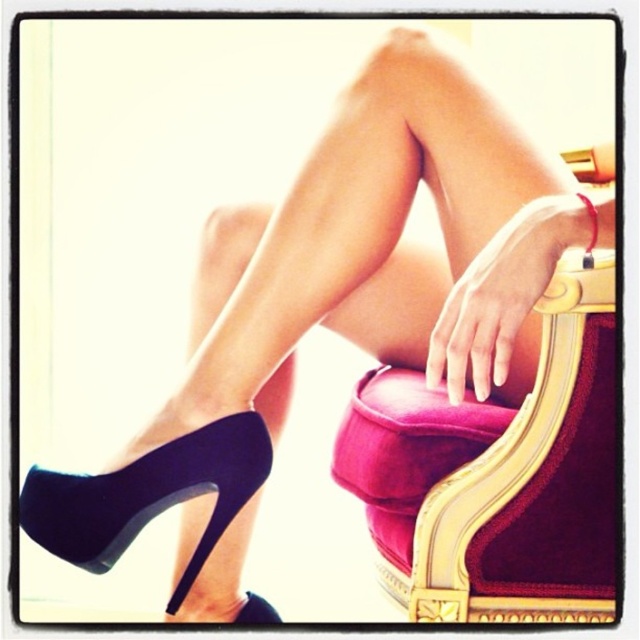
Question: Can you confirm if velvet gold armchair at center is bigger than suede black high-heeled shoe at lower left?

Choices:
 (A) no
 (B) yes

Answer: (B)

Question: Which object appears farthest from the camera in this image?

Choices:
 (A) suede high-heeled shoe at lower left
 (B) suede black high-heeled shoe at lower left

Answer: (A)

Question: Which is farther from the suede black high-heeled shoe at lower left?

Choices:
 (A) suede high-heeled shoe at lower left
 (B) velvet gold armchair at center

Answer: (B)

Question: Which point is closer to the camera taking this photo?

Choices:
 (A) (595, 570)
 (B) (266, 616)

Answer: (A)

Question: Does suede black high-heeled shoe at lower left have a larger size compared to suede high-heeled shoe at lower left?

Choices:
 (A) yes
 (B) no

Answer: (A)

Question: Is suede black high-heeled shoe at lower left smaller than suede high-heeled shoe at lower left?

Choices:
 (A) no
 (B) yes

Answer: (A)